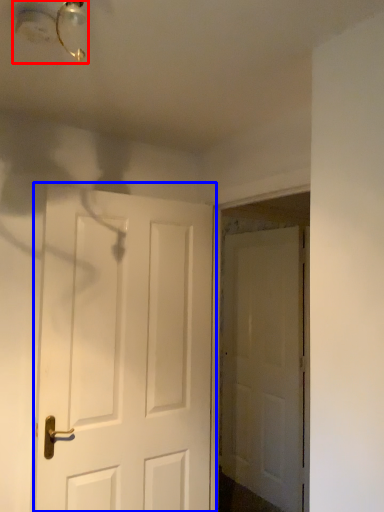
Question: Which object appears closest to the camera in this image, light fixture (highlighted by a red box) or door (highlighted by a blue box)?

Choices:
 (A) light fixture
 (B) door

Answer: (A)